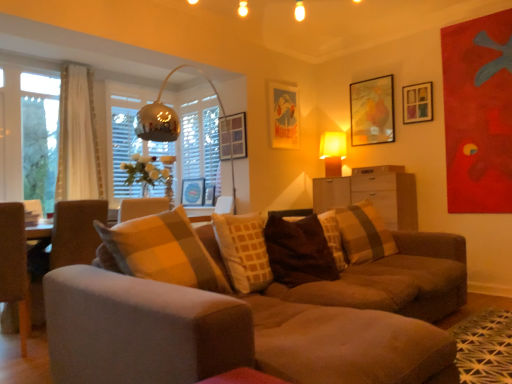
Question: Does matte brown dresser at center lie behind matte wooden picture frame at center, the 5th picture frame when ordered from right to left?

Choices:
 (A) yes
 (B) no

Answer: (B)

Question: Does matte brown dresser at center have a lesser height compared to matte wooden picture frame at center, the 5th picture frame when ordered from right to left?

Choices:
 (A) no
 (B) yes

Answer: (A)

Question: Can you see matte brown dresser at center touching matte wooden picture frame at center, which is the 2th picture frame in left-to-right order?

Choices:
 (A) yes
 (B) no

Answer: (B)

Question: From the image's perspective, is matte brown dresser at center on matte wooden picture frame at center, the 5th picture frame when ordered from right to left?

Choices:
 (A) no
 (B) yes

Answer: (A)

Question: Could matte wooden picture frame at center, which is the 2th picture frame in left-to-right order, be considered to be inside matte brown dresser at center?

Choices:
 (A) yes
 (B) no

Answer: (B)

Question: Considering the relative sizes of matte brown dresser at center and matte wooden picture frame at center, which is the 2th picture frame in left-to-right order, in the image provided, is matte brown dresser at center smaller than matte wooden picture frame at center, which is the 2th picture frame in left-to-right order,?

Choices:
 (A) no
 (B) yes

Answer: (A)

Question: Considering the relative sizes of white glossy drawer at center and matte brown dresser at center in the image provided, is white glossy drawer at center thinner than matte brown dresser at center?

Choices:
 (A) yes
 (B) no

Answer: (A)

Question: Does white glossy drawer at center have a smaller size compared to matte brown dresser at center?

Choices:
 (A) yes
 (B) no

Answer: (A)

Question: From the image's perspective, is white glossy drawer at center beneath matte brown dresser at center?

Choices:
 (A) yes
 (B) no

Answer: (B)

Question: Is white glossy drawer at center to the right of matte brown dresser at center from the viewer's perspective?

Choices:
 (A) yes
 (B) no

Answer: (A)

Question: Considering the relative sizes of white glossy drawer at center and matte brown dresser at center in the image provided, is white glossy drawer at center wider than matte brown dresser at center?

Choices:
 (A) no
 (B) yes

Answer: (A)

Question: From a real-world perspective, is white glossy drawer at center under matte brown dresser at center?

Choices:
 (A) yes
 (B) no

Answer: (B)

Question: From a real-world perspective, is matte wooden picture frame at center, which is the 2th picture frame in left-to-right order, positioned over matte paper picture frame at upper center, placed as the third picture frame when sorted from right to left, based on gravity?

Choices:
 (A) no
 (B) yes

Answer: (A)